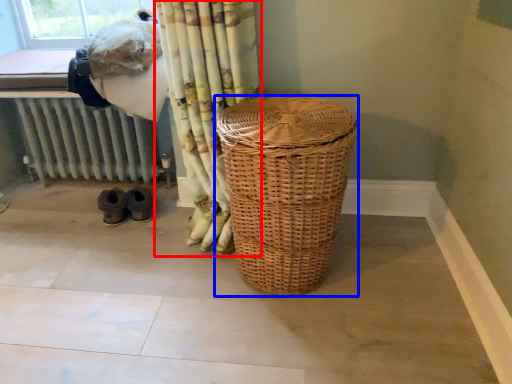
Question: Which object is further to the camera taking this photo, curtain (highlighted by a red box) or laundry basket (highlighted by a blue box)?

Choices:
 (A) curtain
 (B) laundry basket

Answer: (A)